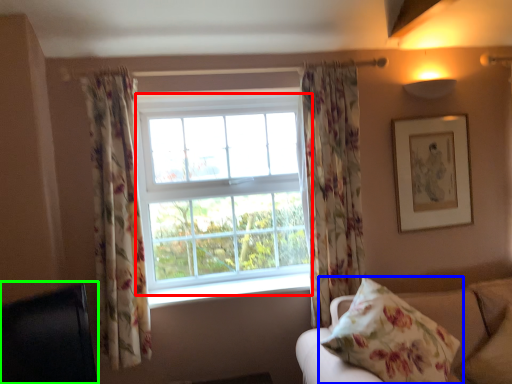
Question: Considering the real-world distances, which object is farthest from bay window (highlighted by a red box)? pillow (highlighted by a blue box) or furniture (highlighted by a green box)?

Choices:
 (A) pillow
 (B) furniture

Answer: (A)